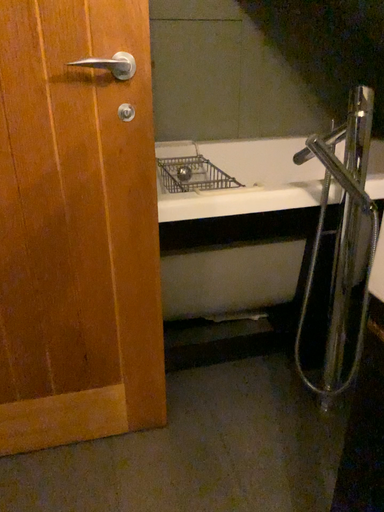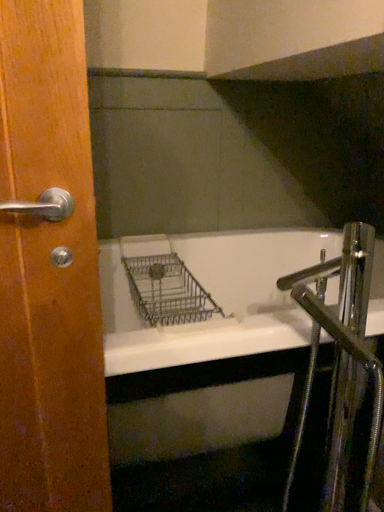
Question: How did the camera likely rotate when shooting the video?

Choices:
 (A) rotated downward
 (B) rotated upward

Answer: (B)